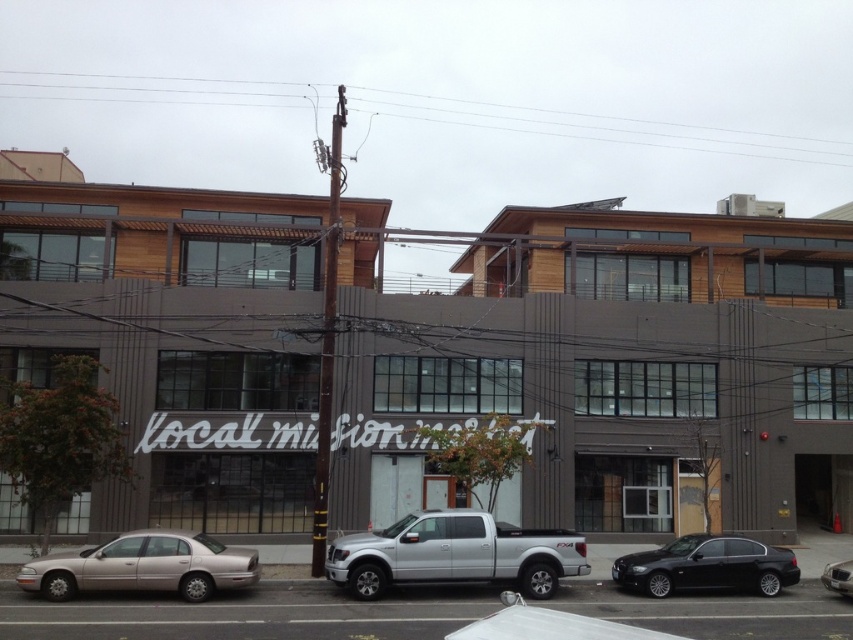
You are a pedestrian standing on the sidewalk in front of the building. You need to cross the street to reach the utility pole. Which vehicle, the black metallic sedan at lower right or the metallic silver sedan at center, would you have to go around first?

The black metallic sedan at lower right is closer to you, so you would have to go around it first before reaching the metallic silver sedan at center.

You are standing at the curb looking at the parked vehicles. Which vehicle, the gold metallic sedan at lower left or the metallic silver sedan at center, is positioned closer to the utility pole?

The gold metallic sedan at lower left is positioned closer to the utility pole because it is located above the metallic silver sedan at center, meaning it is closer to the foreground where the utility pole is situated.

You are standing at the center of the street and want to walk to the gold metallic sedan at lower left. Which direction should you walk to reach it?

You should walk towards the lower left direction to reach the gold metallic sedan at lower left since it is located at point (144, 566).